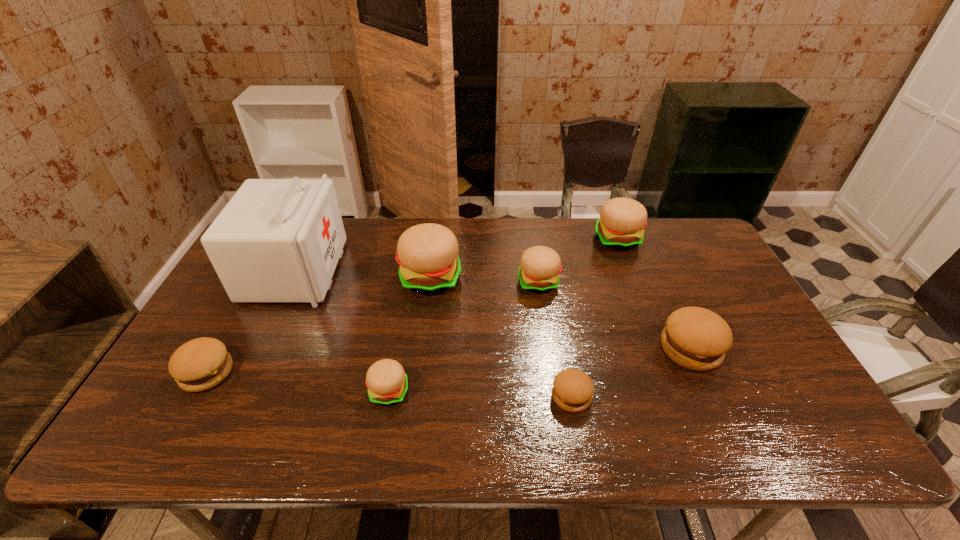
Identify the location of the nearest beige hamburger. (386, 380).

Identify the location of the smallest brown hamburger. The height and width of the screenshot is (540, 960). (572, 391).

Where is `the shortest hamburger`? This screenshot has height=540, width=960. the shortest hamburger is located at coordinates tap(572, 391).

Identify the location of free region located on the front-facing side of the tallest object. (434, 271).

Locate an element on the screen. The height and width of the screenshot is (540, 960). free region located on the front of the second tallest object is located at coordinates (413, 416).

Find the location of a particular element. free spot located on the left of the third tallest object is located at coordinates (542, 239).

Identify the location of vacant area situated on the back of the third biggest beige hamburger. (529, 218).

Image resolution: width=960 pixels, height=540 pixels. I want to click on free space located 0.200m on the left of the rightmost brown hamburger, so click(x=587, y=348).

The width and height of the screenshot is (960, 540). I want to click on vacant area situated 0.340m on the right of the second smallest brown hamburger, so (365, 373).

At what (x,y) coordinates should I click in order to perform the action: click on vacant space located on the left of the smallest beige hamburger. Please return your answer as a coordinate pair (x, y). The image size is (960, 540). Looking at the image, I should click on (300, 392).